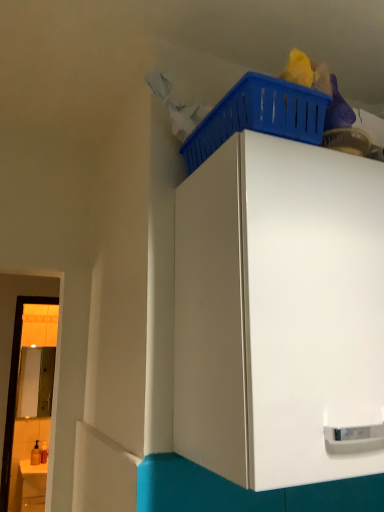
Question: Is white glossy cabinet at upper center not inside matte white counter at lower left?

Choices:
 (A) no
 (B) yes

Answer: (B)

Question: Considering the relative sizes of white glossy cabinet at upper center and matte white counter at lower left in the image provided, is white glossy cabinet at upper center bigger than matte white counter at lower left?

Choices:
 (A) yes
 (B) no

Answer: (A)

Question: From the image's perspective, would you say white glossy cabinet at upper center is shown under matte white counter at lower left?

Choices:
 (A) yes
 (B) no

Answer: (B)

Question: From a real-world perspective, is white glossy cabinet at upper center located higher than matte white counter at lower left?

Choices:
 (A) yes
 (B) no

Answer: (A)

Question: Can you confirm if white glossy cabinet at upper center is positioned to the left of matte white counter at lower left?

Choices:
 (A) yes
 (B) no

Answer: (B)

Question: From the image's perspective, is blue plastic basket at upper right positioned above or below matte white counter at lower left?

Choices:
 (A) above
 (B) below

Answer: (A)

Question: Is point (302, 90) closer or farther from the camera than point (39, 501)?

Choices:
 (A) closer
 (B) farther

Answer: (A)

Question: In the image, is blue plastic basket at upper right positioned in front of or behind matte white counter at lower left?

Choices:
 (A) behind
 (B) front

Answer: (B)

Question: Is blue plastic basket at upper right inside or outside of matte white counter at lower left?

Choices:
 (A) outside
 (B) inside

Answer: (A)

Question: From a real-world perspective, is matte white counter at lower left positioned above or below white glossy cabinet at upper center?

Choices:
 (A) above
 (B) below

Answer: (B)

Question: Does point (34, 470) appear closer or farther from the camera than point (365, 393)?

Choices:
 (A) farther
 (B) closer

Answer: (A)

Question: From the image's perspective, is matte white counter at lower left located above or below white glossy cabinet at upper center?

Choices:
 (A) below
 (B) above

Answer: (A)

Question: Considering the positions of matte white counter at lower left and white glossy cabinet at upper center in the image, is matte white counter at lower left taller or shorter than white glossy cabinet at upper center?

Choices:
 (A) short
 (B) tall

Answer: (A)

Question: From the image's perspective, is white glossy cabinet at upper center positioned above or below matte white counter at lower left?

Choices:
 (A) below
 (B) above

Answer: (B)

Question: From a real-world perspective, relative to matte white counter at lower left, is white glossy cabinet at upper center vertically above or below?

Choices:
 (A) below
 (B) above

Answer: (B)